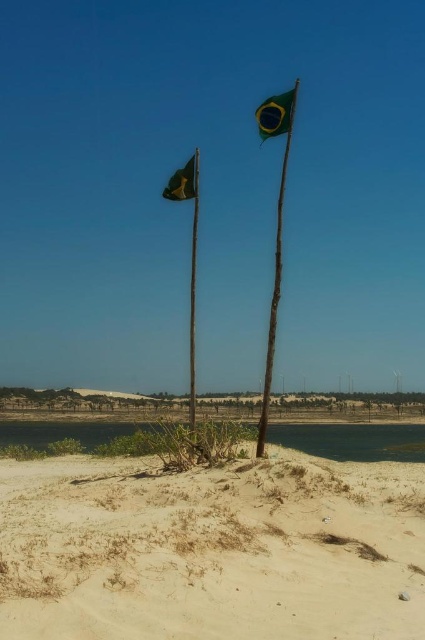
What do you see at coordinates (275, 113) in the screenshot? Image resolution: width=425 pixels, height=640 pixels. I see `green fabric flag at upper center` at bounding box center [275, 113].

Who is more distant from viewer, (260,120) or (184,176)?

The point (184,176) is more distant.

Locate an element on the screen. The width and height of the screenshot is (425, 640). green fabric flag at upper center is located at coordinates (275, 113).

Can you confirm if green fabric flag pole at center is smaller than green fabric flag at upper center?

Correct, green fabric flag pole at center occupies less space than green fabric flag at upper center.

Between green fabric flag pole at center and green fabric flag at upper center, which one has more height?

With more height is green fabric flag pole at center.

Which is in front, point (192, 275) or point (280, 132)?

Point (280, 132)

Identify the location of green fabric flag pole at center. (192, 284).

What do you see at coordinates (212, 548) in the screenshot? The height and width of the screenshot is (640, 425). I see `sandy beige sand at lower center` at bounding box center [212, 548].

Is sandy beige sand at lower center closer to the viewer compared to green fabric flag at center?

That is True.

The height and width of the screenshot is (640, 425). Describe the element at coordinates (212, 548) in the screenshot. I see `sandy beige sand at lower center` at that location.

At what (x,y) coordinates should I click in order to perform the action: click on sandy beige sand at lower center. Please return your answer as a coordinate pair (x, y). The image size is (425, 640). Looking at the image, I should click on (212, 548).